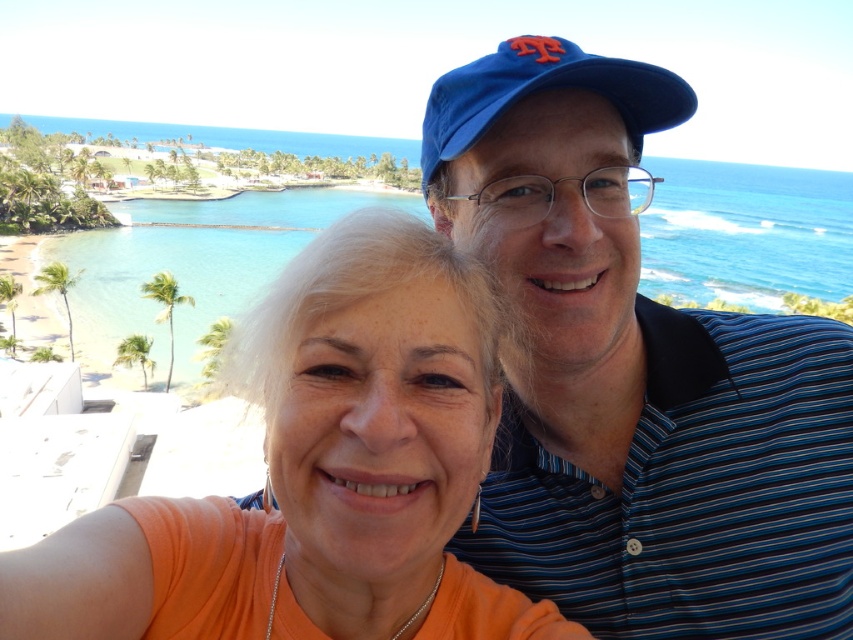
You are a photographer trying to frame a shot of the orange matte shirt at center and the blue fabric baseball cap at upper center. Which object should you adjust your camera to focus on first if you want to capture both in a single frame without zooming in or out?

The orange matte shirt at center should be focused on first because it is narrower than the blue fabric baseball cap at upper center, allowing more space to include both in the frame.

You are a photographer trying to capture the perfect shot of the two people in the image. The blue striped polo shirt at upper right and the orange matte shirt at center are both in the frame. Based on their positions, which shirt is closer to the right edge of the photo?

The blue striped polo shirt at upper right is to the right of the orange matte shirt at center, so it is closer to the right edge of the photo.